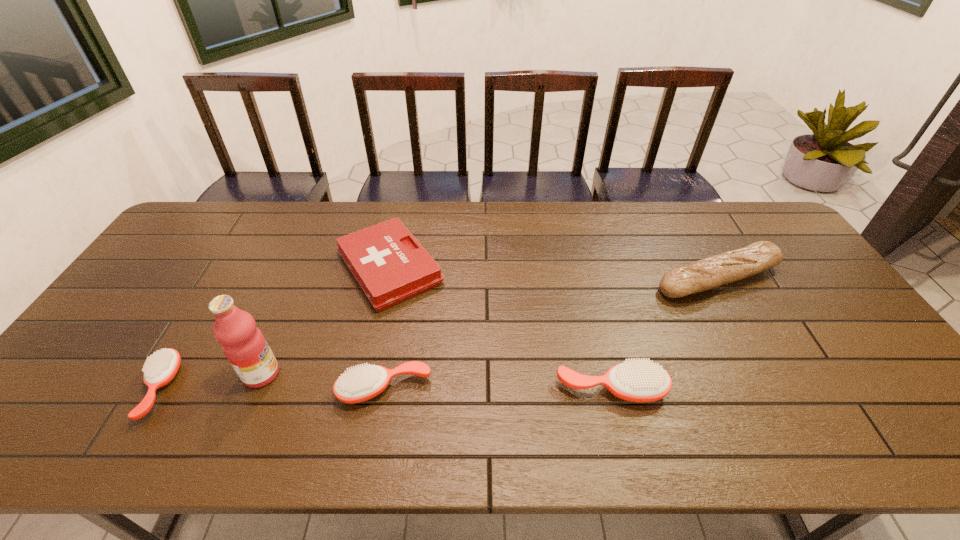
Find the location of a particular element. vacant space located on the left of the rightmost hairbrush is located at coordinates (523, 389).

The width and height of the screenshot is (960, 540). What are the coordinates of `vacant region located 0.260m on the front of the first-aid kit` in the screenshot? It's located at (362, 396).

Identify the location of vacant space located 0.330m on the label of the fruit juice. The width and height of the screenshot is (960, 540). (413, 374).

The height and width of the screenshot is (540, 960). What are the coordinates of `free space located 0.230m on the back of the rightmost object` in the screenshot? It's located at (x=682, y=214).

Locate an element on the screen. Image resolution: width=960 pixels, height=540 pixels. object that is at the far edge is located at coordinates (390, 265).

Find the location of a particular element. The height and width of the screenshot is (540, 960). fruit juice present at the near edge is located at coordinates (244, 345).

Identify the location of object that is at the right edge. (708, 273).

The width and height of the screenshot is (960, 540). I want to click on free space at the far edge, so click(x=638, y=206).

At what (x,y) coordinates should I click in order to perform the action: click on vacant region at the near edge of the desktop. Please return your answer as a coordinate pair (x, y). The width and height of the screenshot is (960, 540). Looking at the image, I should click on (562, 391).

What are the coordinates of `vacant space at the right edge` in the screenshot? It's located at (859, 363).